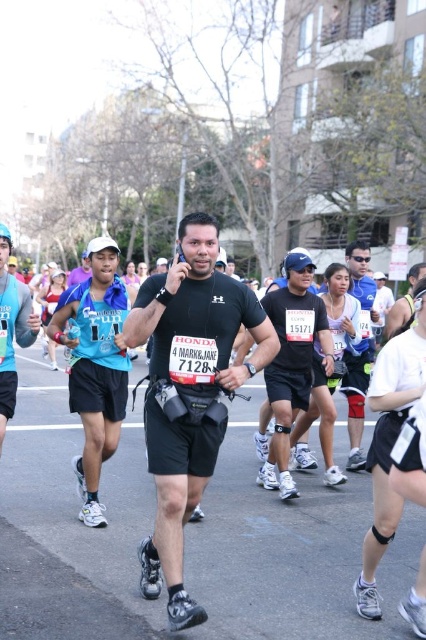
You are a photographer capturing the marathon event. You notice two sets of shorts at the center of the image. Which one is closer to you, the black matte running shorts at center or the matte black shorts at center?

The black matte running shorts at center is closer to the viewer than the matte black shorts at center.

From the picture: What is located at the coordinates point (189,392)?

The black matte running shorts at center are located at point (189,392).

You are a photographer at the marathon event and want to capture a photo of the runner with the black matte running shorts at center without the matte black shorts at center appearing in the foreground. Is this possible?

The black matte running shorts at center is located below the matte black shorts at center, so it is possible to angle the camera downward to avoid the matte black shorts at center appearing in the foreground.